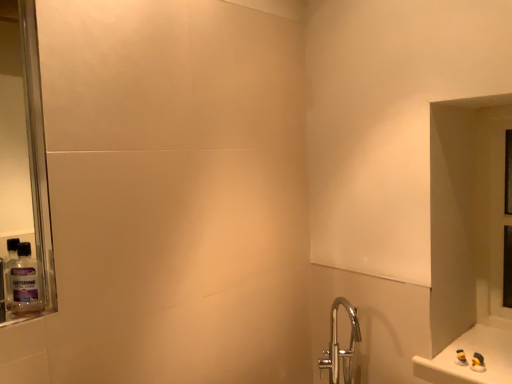
Question: From a real-world perspective, is white glossy counter at lower right positioned over transparent glass door at right based on gravity?

Choices:
 (A) yes
 (B) no

Answer: (B)

Question: Is white glossy counter at lower right smaller than transparent glass door at right?

Choices:
 (A) no
 (B) yes

Answer: (B)

Question: Is white glossy counter at lower right positioned beyond the bounds of transparent glass door at right?

Choices:
 (A) no
 (B) yes

Answer: (B)

Question: From the image's perspective, is white glossy counter at lower right beneath transparent glass door at right?

Choices:
 (A) yes
 (B) no

Answer: (A)

Question: Is white glossy counter at lower right behind transparent glass door at right?

Choices:
 (A) yes
 (B) no

Answer: (B)

Question: Is white glossy counter at lower right placed right next to transparent glass door at right?

Choices:
 (A) yes
 (B) no

Answer: (B)

Question: Would you consider transparent glass door at right to be distant from white glossy counter at lower right?

Choices:
 (A) yes
 (B) no

Answer: (B)

Question: From a real-world perspective, is transparent glass door at right over white glossy counter at lower right?

Choices:
 (A) no
 (B) yes

Answer: (B)

Question: Can you confirm if transparent glass door at right is wider than white glossy counter at lower right?

Choices:
 (A) yes
 (B) no

Answer: (B)

Question: Is transparent glass door at right surrounding white glossy counter at lower right?

Choices:
 (A) no
 (B) yes

Answer: (A)

Question: Does transparent glass door at right appear on the right side of white glossy counter at lower right?

Choices:
 (A) yes
 (B) no

Answer: (A)

Question: Could you tell me if transparent glass door at right is facing white glossy counter at lower right?

Choices:
 (A) yes
 (B) no

Answer: (A)

Question: Can you confirm if clear plastic mouthwash at left is thinner than transparent glass door at right?

Choices:
 (A) yes
 (B) no

Answer: (A)